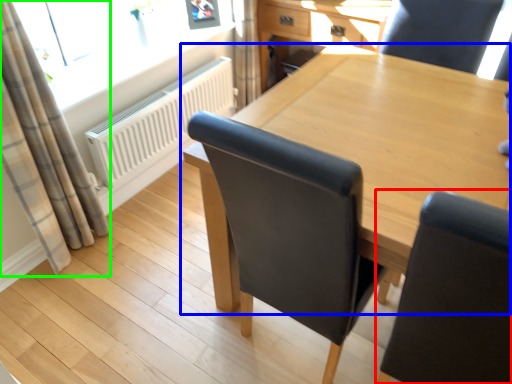
Question: Which is nearer to the chair (highlighted by a red box)? table (highlighted by a blue box) or curtain (highlighted by a green box).

Choices:
 (A) table
 (B) curtain

Answer: (A)